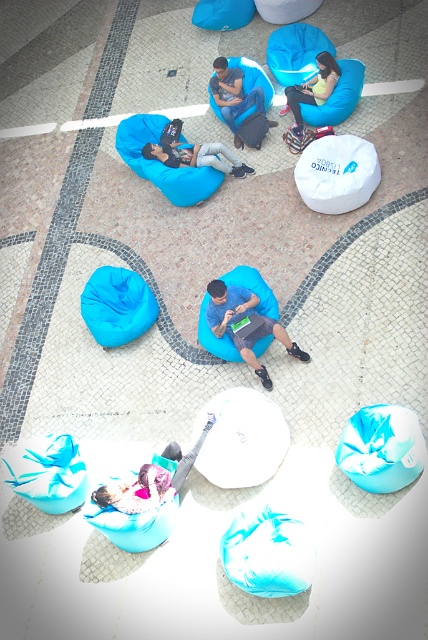
Between blue fabric bean bag at center and matte black laptop at center, which one appears on the left side from the viewer's perspective?

From the viewer's perspective, matte black laptop at center appears more on the left side.

Between point (234, 289) and point (202, 147), which one is positioned behind?

The point (202, 147) is behind.

Which is in front, point (258, 301) or point (220, 144)?

Point (258, 301) is in front.

You are a GUI agent. You are given a task and a screenshot of the screen. Output one action in this format:
    pyautogui.click(x=<x>, y=<y>)
    Task: Click on the blue fabric bean bag at center
    This screenshot has height=640, width=428.
    Given the screenshot: What is the action you would take?
    pyautogui.click(x=244, y=324)

Does matte blue bean bag at lower center have a larger size compared to matte blue bean bag at upper right?

Indeed, matte blue bean bag at lower center has a larger size compared to matte blue bean bag at upper right.

Does matte blue bean bag at lower center have a lesser height compared to matte blue bean bag at upper right?

Correct, matte blue bean bag at lower center is not as tall as matte blue bean bag at upper right.

Is point (140, 490) closer to camera compared to point (336, 74)?

Yes, it is.

Identify the location of matte blue bean bag at lower center. Image resolution: width=428 pixels, height=640 pixels. (148, 483).

Between blue fabric bean bag at center and matte blue bean bag at center, which one has less height?

With less height is blue fabric bean bag at center.

How far apart are blue fabric bean bag at center and matte blue bean bag at center?

blue fabric bean bag at center is 10.65 feet away from matte blue bean bag at center.

Find the location of a particular element. blue fabric bean bag at center is located at coordinates point(244,324).